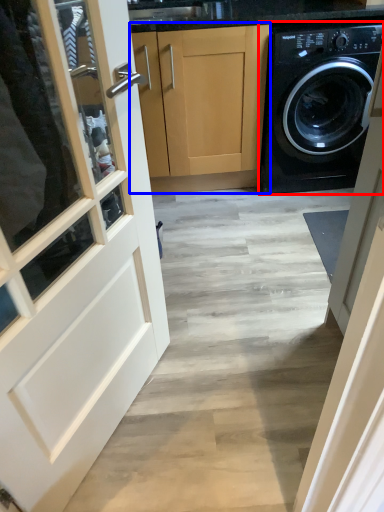
Question: Which point is further to the camera, washing machine (highlighted by a red box) or cabinetry (highlighted by a blue box)?

Choices:
 (A) washing machine
 (B) cabinetry

Answer: (B)